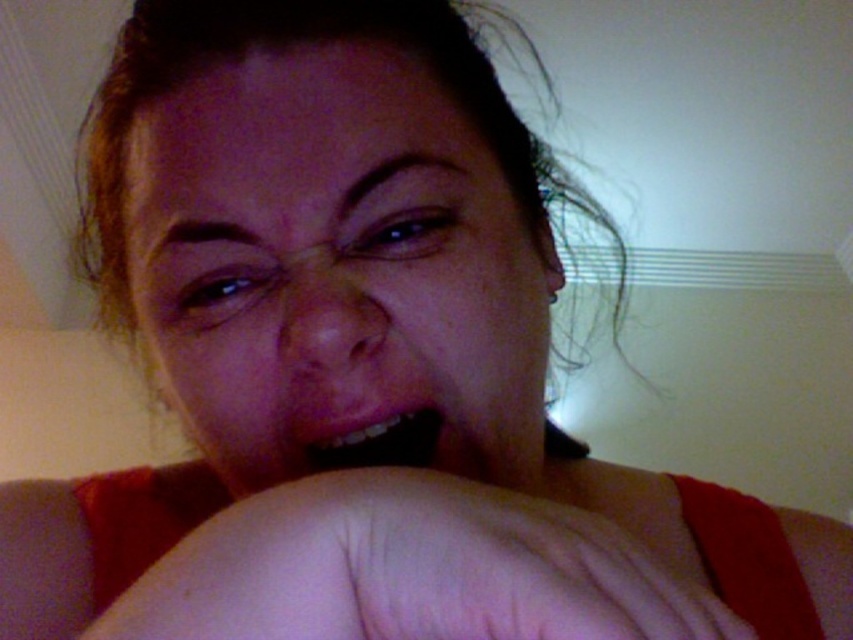
Based on the scene description, which object is bigger between the smooth skin at center and the pink matte lips at center?

The smooth skin at center is larger in size than the pink matte lips at center.

You are a photographer adjusting the lighting in a dimly lit room. You notice a point at coordinates (x=412, y=570) on the person in the image. Based on the scene description, what surface property should you consider when adjusting the lighting to ensure the area around this point is well illuminated?

The point at (x=412, y=570) indicates smooth skin at center, so you should consider the smooth surface property of the skin to ensure even lighting and minimize harsh reflections.